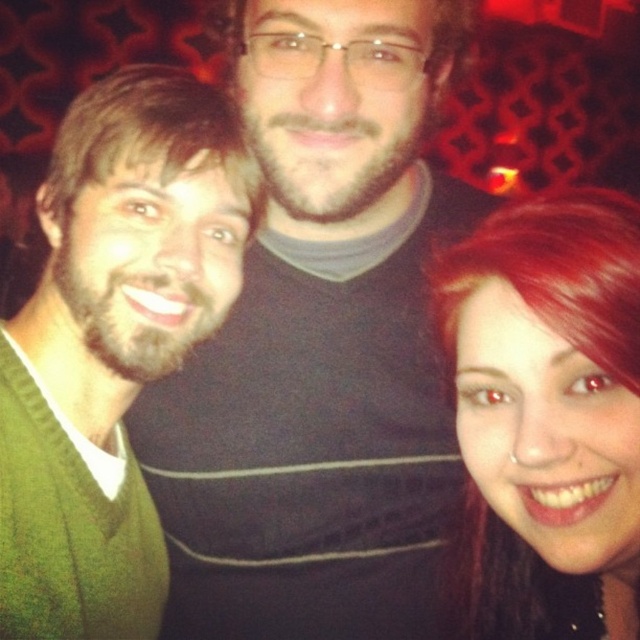
Question: Which of the following is the closest to the observer?

Choices:
 (A) (547, 461)
 (B) (406, 112)
 (C) (84, 332)

Answer: (A)

Question: Can you confirm if matte black shirt at center is positioned to the right of green knitted sweater at left?

Choices:
 (A) yes
 (B) no

Answer: (A)

Question: Which object is closer to the camera taking this photo?

Choices:
 (A) shiny red hair at center
 (B) green knitted sweater at left
 (C) matte black shirt at center

Answer: (A)

Question: Which is nearer to the shiny red hair at center?

Choices:
 (A) green knitted sweater at left
 (B) matte black shirt at center

Answer: (B)

Question: Does matte black shirt at center come behind shiny red hair at center?

Choices:
 (A) yes
 (B) no

Answer: (A)

Question: From the image, what is the correct spatial relationship of green knitted sweater at left in relation to shiny red hair at center?

Choices:
 (A) below
 (B) above

Answer: (B)